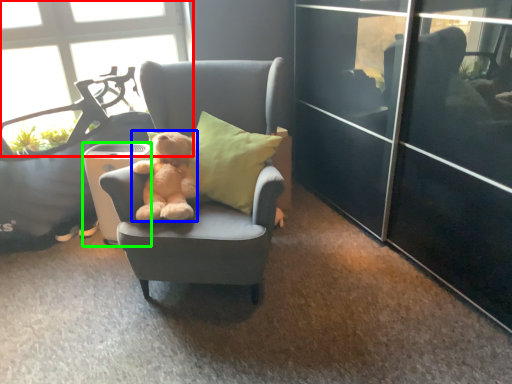
Question: Which object is positioned closest to window (highlighted by a red box)? Select from teddy bear (highlighted by a blue box) and trash bin/can (highlighted by a green box).

Choices:
 (A) teddy bear
 (B) trash bin/can

Answer: (B)